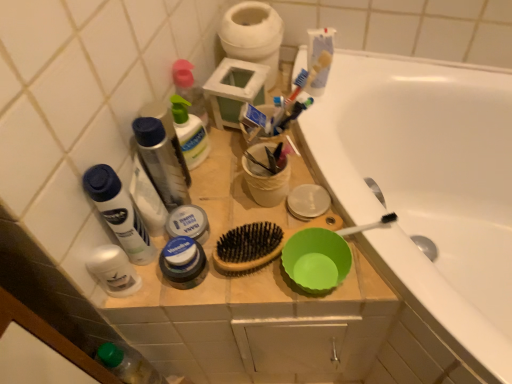
Locate an element on the screen. This screenshot has width=512, height=384. free location in front of metallic silver bowl at upper right, the second basin positioned from the top is located at coordinates (318, 283).